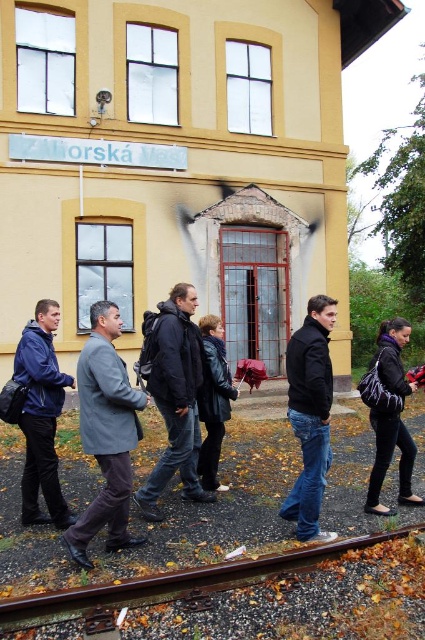
You are a photographer trying to capture the entire group of people and the railway track in one shot. Given that the black matte jacket at center is narrower than the brown metallic train track at lower center, which object should you focus on first to ensure both fit in the frame?

The brown metallic train track at lower center is wider than the black matte jacket at center. To ensure both fit in the frame, focus on framing the wider brown metallic train track at lower center first, then adjust to include the narrower black matte jacket at center.

You are standing at the entrance of the yellow building with the red metal gate. You want to walk to the brown metallic train track at lower center. According to the image, in which direction should you go from your current position?

The brown metallic train track at lower center is located at point (257, 598). Since you are at the entrance of the yellow building, which is near the lower left corner of the image, you should head towards the lower center direction to reach the brown metallic train track at lower center.

You are a photographer trying to capture a photo of the group walking along the railway track. You need to ensure both the gray wool coat at center and the leather jacket at center are visible in the frame. Which item should you focus on first to make sure both are in the shot?

The gray wool coat at center is positioned on the left side of the leather jacket at center. To ensure both are in the frame, focus on the gray wool coat at center first as it is on the left, then adjust to include the leather jacket at center on the right.